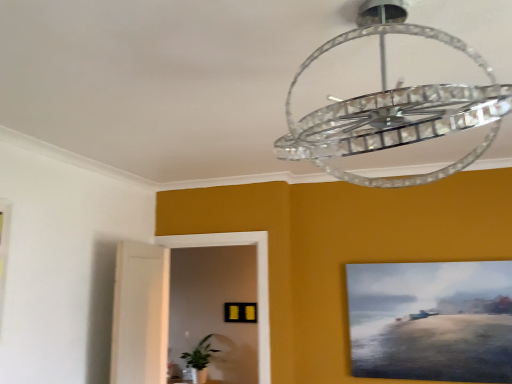
The width and height of the screenshot is (512, 384). What do you see at coordinates (199, 359) in the screenshot?
I see `green leafy plant at lower left` at bounding box center [199, 359].

What do you see at coordinates (431, 320) in the screenshot? I see `matte canvas painting at right, which is the first picture frame in top-to-bottom order` at bounding box center [431, 320].

Locate an element on the screen. Image resolution: width=512 pixels, height=384 pixels. clear crystal chandelier at upper center is located at coordinates tap(393, 107).

Considering the relative sizes of clear crystal chandelier at upper center and matte yellow picture frame at center, acting as the 2th picture frame starting from the front, in the image provided, is clear crystal chandelier at upper center wider than matte yellow picture frame at center, acting as the 2th picture frame starting from the front,?

Yes, clear crystal chandelier at upper center is wider than matte yellow picture frame at center, acting as the 2th picture frame starting from the front.

Is the surface of clear crystal chandelier at upper center in direct contact with matte yellow picture frame at center, the 1th picture frame positioned from the left?

There is a gap between clear crystal chandelier at upper center and matte yellow picture frame at center, the 1th picture frame positioned from the left.

Is clear crystal chandelier at upper center to the left of matte yellow picture frame at center, the 1th picture frame positioned from the left, from the viewer's perspective?

Incorrect, clear crystal chandelier at upper center is not on the left side of matte yellow picture frame at center, the 1th picture frame positioned from the left.

Could you tell me if clear crystal chandelier at upper center is facing matte yellow picture frame at center, which ranks as the 1th picture frame in back-to-front order?

No, clear crystal chandelier at upper center does not turn towards matte yellow picture frame at center, which ranks as the 1th picture frame in back-to-front order.

In the image, is matte yellow picture frame at center, the 1th picture frame positioned from the left, positioned in front of or behind clear crystal chandelier at upper center?

In the image, matte yellow picture frame at center, the 1th picture frame positioned from the left, appears behind clear crystal chandelier at upper center.

Is matte yellow picture frame at center, which is counted as the second picture frame, starting from the top, taller or shorter than clear crystal chandelier at upper center?

matte yellow picture frame at center, which is counted as the second picture frame, starting from the top, is shorter than clear crystal chandelier at upper center.

Measure the distance from matte yellow picture frame at center, which is counted as the second picture frame, starting from the top, to clear crystal chandelier at upper center.

The distance of matte yellow picture frame at center, which is counted as the second picture frame, starting from the top, from clear crystal chandelier at upper center is 3.31 meters.

Considering the relative positions of matte yellow picture frame at center, which ranks as the 1th picture frame in back-to-front order, and clear crystal chandelier at upper center in the image provided, is matte yellow picture frame at center, which ranks as the 1th picture frame in back-to-front order, to the left or to the right of clear crystal chandelier at upper center?

In the image, matte yellow picture frame at center, which ranks as the 1th picture frame in back-to-front order, appears on the left side of clear crystal chandelier at upper center.

From a real-world perspective, is matte yellow picture frame at center, acting as the 2th picture frame starting from the front, positioned under matte canvas painting at right, which is the first picture frame from front to back, based on gravity?

Correct, in the physical world, matte yellow picture frame at center, acting as the 2th picture frame starting from the front, is lower than matte canvas painting at right, which is the first picture frame from front to back.

Is matte yellow picture frame at center, the 1th picture frame positioned from the left, inside or outside of matte canvas painting at right, which is the first picture frame from front to back?

matte yellow picture frame at center, the 1th picture frame positioned from the left, cannot be found inside matte canvas painting at right, which is the first picture frame from front to back.

Can you confirm if matte yellow picture frame at center, the 1th picture frame positioned from the left, is shorter than matte canvas painting at right, which is the first picture frame from front to back?

Correct, matte yellow picture frame at center, the 1th picture frame positioned from the left, is not as tall as matte canvas painting at right, which is the first picture frame from front to back.

Is green leafy plant at lower left wider or thinner than clear crystal chandelier at upper center?

Considering their sizes, green leafy plant at lower left looks slimmer than clear crystal chandelier at upper center.

At what (x,y) coordinates should I click in order to perform the action: click on houseplant below the clear crystal chandelier at upper center (from a real-world perspective). Please return your answer as a coordinate pair (x, y). This screenshot has height=384, width=512. Looking at the image, I should click on (199, 359).

From a real-world perspective, which object rests below the other?

green leafy plant at lower left, from a real-world perspective.

From the image's perspective, is green leafy plant at lower left positioned above or below clear crystal chandelier at upper center?

Clearly, from the image's perspective, green leafy plant at lower left is below clear crystal chandelier at upper center.

Considering the sizes of matte yellow picture frame at center, acting as the 2th picture frame starting from the front, and green leafy plant at lower left in the image, is matte yellow picture frame at center, acting as the 2th picture frame starting from the front, wider or thinner than green leafy plant at lower left?

Clearly, matte yellow picture frame at center, acting as the 2th picture frame starting from the front, has less width compared to green leafy plant at lower left.

Can you confirm if matte yellow picture frame at center, marked as the first picture frame in a bottom-to-top arrangement, is bigger than green leafy plant at lower left?

Actually, matte yellow picture frame at center, marked as the first picture frame in a bottom-to-top arrangement, might be smaller than green leafy plant at lower left.

Is there a large distance between matte yellow picture frame at center, which appears as the second picture frame when viewed from the right, and green leafy plant at lower left?

No, there isn't a large distance between matte yellow picture frame at center, which appears as the second picture frame when viewed from the right, and green leafy plant at lower left.

Which is behind, point (424, 327) or point (197, 375)?

Positioned behind is point (197, 375).

How many degrees apart are the facing directions of matte canvas painting at right, which is the second picture frame from left to right, and green leafy plant at lower left?

0.435 degrees.

Is matte canvas painting at right, the 2th picture frame viewed from the back, taller or shorter than green leafy plant at lower left?

Considering their sizes, matte canvas painting at right, the 2th picture frame viewed from the back, has more height than green leafy plant at lower left.

Which is more to the right, matte canvas painting at right, which is the second picture frame from left to right, or green leafy plant at lower left?

From the viewer's perspective, matte canvas painting at right, which is the second picture frame from left to right, appears more on the right side.

Which of these two, green leafy plant at lower left or matte canvas painting at right, placed as the first picture frame when sorted from right to left, is smaller?

matte canvas painting at right, placed as the first picture frame when sorted from right to left, is smaller.

From a real-world perspective, is green leafy plant at lower left positioned over matte canvas painting at right, placed as the first picture frame when sorted from right to left, based on gravity?

Actually, green leafy plant at lower left is physically below matte canvas painting at right, placed as the first picture frame when sorted from right to left, in the real world.

Considering the sizes of green leafy plant at lower left and matte canvas painting at right, which is the first picture frame in top-to-bottom order, in the image, is green leafy plant at lower left taller or shorter than matte canvas painting at right, which is the first picture frame in top-to-bottom order,?

Considering their sizes, green leafy plant at lower left has less height than matte canvas painting at right, which is the first picture frame in top-to-bottom order.

Between green leafy plant at lower left and matte canvas painting at right, which is the first picture frame in top-to-bottom order, which one has smaller width?

matte canvas painting at right, which is the first picture frame in top-to-bottom order, is thinner.

From the clear crystal chandelier at upper center, count 2nd picture frames backward and point to it. Please provide its 2D coordinates.

[(240, 312)]

I want to click on lamp lying in front of the matte yellow picture frame at center, the 1th picture frame positioned from the left, so click(x=393, y=107).

When comparing their distances from clear crystal chandelier at upper center, does matte yellow picture frame at center, marked as the first picture frame in a bottom-to-top arrangement, or matte canvas painting at right, placed as the first picture frame when sorted from right to left, seem closer?

matte canvas painting at right, placed as the first picture frame when sorted from right to left, is closer to clear crystal chandelier at upper center.

Based on their spatial positions, is clear crystal chandelier at upper center or matte canvas painting at right, which is the second picture frame from left to right, further from matte yellow picture frame at center, which appears as the second picture frame when viewed from the right?

clear crystal chandelier at upper center.

From the picture: Considering their positions, is matte canvas painting at right, which is the first picture frame in top-to-bottom order, positioned further to green leafy plant at lower left than clear crystal chandelier at upper center?

clear crystal chandelier at upper center.

When comparing their distances from matte canvas painting at right, the 2th picture frame viewed from the back, does green leafy plant at lower left or clear crystal chandelier at upper center seem closer?

Based on the image, clear crystal chandelier at upper center appears to be nearer to matte canvas painting at right, the 2th picture frame viewed from the back.

Looking at the image, which one is located closer to clear crystal chandelier at upper center, matte canvas painting at right, arranged as the second picture frame when ordered from the bottom, or green leafy plant at lower left?

matte canvas painting at right, arranged as the second picture frame when ordered from the bottom, is closer to clear crystal chandelier at upper center.

From the image, which object appears to be farther from matte canvas painting at right, arranged as the second picture frame when ordered from the bottom, clear crystal chandelier at upper center or green leafy plant at lower left?

green leafy plant at lower left.

Looking at the image, which one is located further to green leafy plant at lower left, matte canvas painting at right, which is the second picture frame from left to right, or matte yellow picture frame at center, which ranks as the 1th picture frame in back-to-front order?

matte canvas painting at right, which is the second picture frame from left to right, is positioned further to the anchor green leafy plant at lower left.

From the image, which object appears to be farther from matte yellow picture frame at center, the 1th picture frame positioned from the left, green leafy plant at lower left or clear crystal chandelier at upper center?

clear crystal chandelier at upper center lies further to matte yellow picture frame at center, the 1th picture frame positioned from the left, than the other object.

Identify the location of houseplant between matte canvas painting at right, placed as the first picture frame when sorted from right to left, and matte yellow picture frame at center, acting as the 2th picture frame starting from the front, in the front-back direction. (199, 359).

This screenshot has width=512, height=384. I want to click on picture frame located between clear crystal chandelier at upper center and green leafy plant at lower left in the depth direction, so click(x=431, y=320).

Locate an element on the screen. This screenshot has height=384, width=512. houseplant between clear crystal chandelier at upper center and matte yellow picture frame at center, which is counted as the second picture frame, starting from the top, along the z-axis is located at coordinates (199, 359).

This screenshot has height=384, width=512. Identify the location of picture frame positioned between clear crystal chandelier at upper center and matte yellow picture frame at center, the 1th picture frame positioned from the left, from near to far. (431, 320).